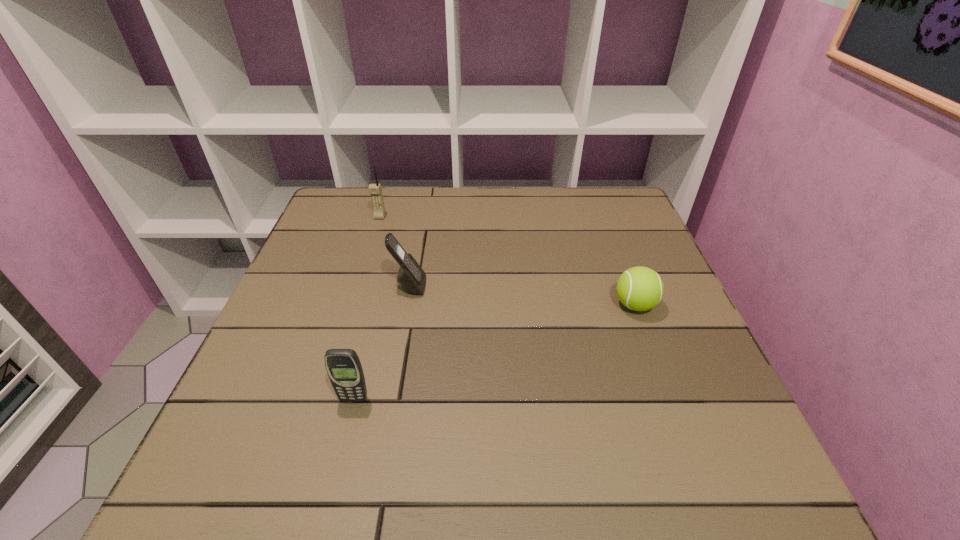
Identify the location of free space between the second nearest cellular telephone and the nearest object. The width and height of the screenshot is (960, 540). (381, 342).

The width and height of the screenshot is (960, 540). What are the coordinates of `free space between the rightmost object and the farthest object` in the screenshot? It's located at (507, 261).

The width and height of the screenshot is (960, 540). I want to click on free space between the farthest object and the nearest object, so click(x=367, y=308).

This screenshot has width=960, height=540. What are the coordinates of `free space that is in between the rightmost object and the leftmost object` in the screenshot? It's located at (507, 261).

Identify the location of free space that is in between the leftmost object and the tennis ball. (507, 261).

Find the location of a particular element. Image resolution: width=960 pixels, height=540 pixels. free space between the nearest object and the rightmost object is located at coordinates (494, 352).

This screenshot has width=960, height=540. Identify the location of empty location between the second farthest cellular telephone and the rightmost object. (522, 295).

The height and width of the screenshot is (540, 960). Identify the location of vacant space in between the nearest object and the leftmost cellular telephone. (367, 308).

Where is `object that can be found as the closest to the leftmost cellular telephone`? The width and height of the screenshot is (960, 540). object that can be found as the closest to the leftmost cellular telephone is located at coordinates (411, 277).

Locate which object is the second closest to the shortest object. Please provide its 2D coordinates. Your answer should be formatted as a tuple, i.e. [(x, y)], where the tuple contains the x and y coordinates of a point satisfying the conditions above.

[(343, 366)]